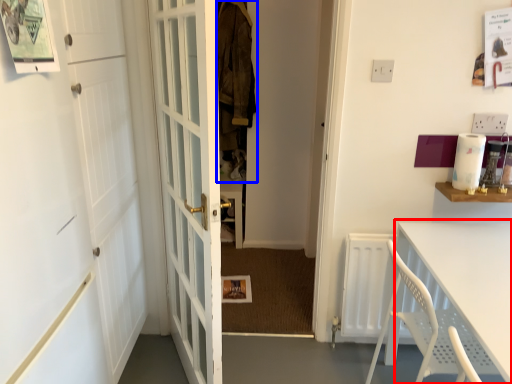
Question: Among these objects, which one is farthest to the camera, table (highlighted by a red box) or laundry (highlighted by a blue box)?

Choices:
 (A) table
 (B) laundry

Answer: (B)